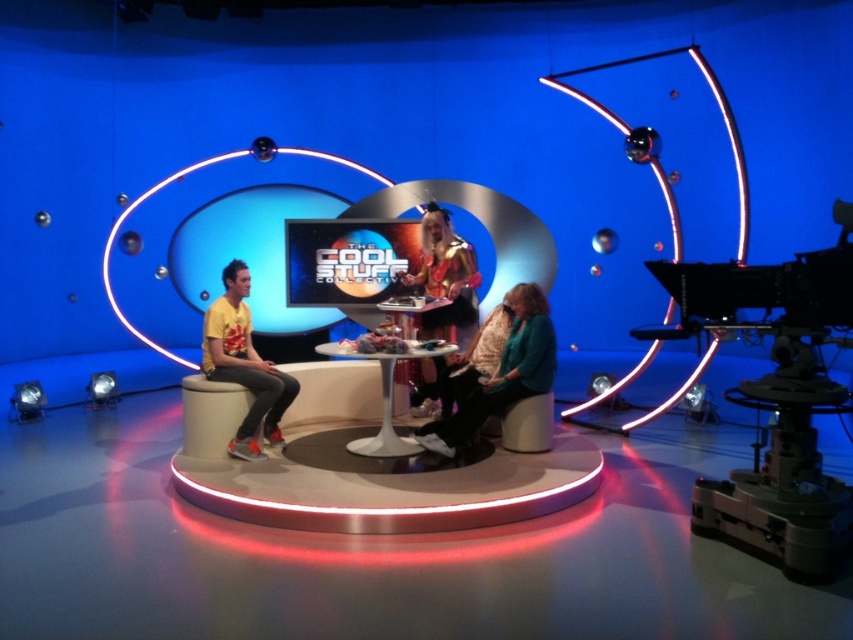
Is teal fabric jacket at center thinner than gold metallic costume at center?

Incorrect, teal fabric jacket at center's width is not less than gold metallic costume at center's.

Is teal fabric jacket at center smaller than gold metallic costume at center?

Indeed, teal fabric jacket at center has a smaller size compared to gold metallic costume at center.

What do you see at coordinates (503, 372) in the screenshot?
I see `teal fabric jacket at center` at bounding box center [503, 372].

Image resolution: width=853 pixels, height=640 pixels. I want to click on teal fabric jacket at center, so click(503, 372).

Is point (451, 300) positioned before point (351, 442)?

No, it is not.

Between gold metallic costume at center and white glossy round table at center, which one appears on the left side from the viewer's perspective?

Positioned to the left is white glossy round table at center.

Which is in front, point (442, 401) or point (408, 452)?

Point (408, 452) is in front.

In order to click on gold metallic costume at center in this screenshot , I will do `click(445, 276)`.

Who is taller, teal fabric jacket at center or white glossy round table at center?

teal fabric jacket at center

Does point (521, 321) come in front of point (392, 420)?

Yes, point (521, 321) is in front of point (392, 420).

What do you see at coordinates (503, 372) in the screenshot?
I see `teal fabric jacket at center` at bounding box center [503, 372].

Find the location of `teal fabric jacket at center`. teal fabric jacket at center is located at coordinates (503, 372).